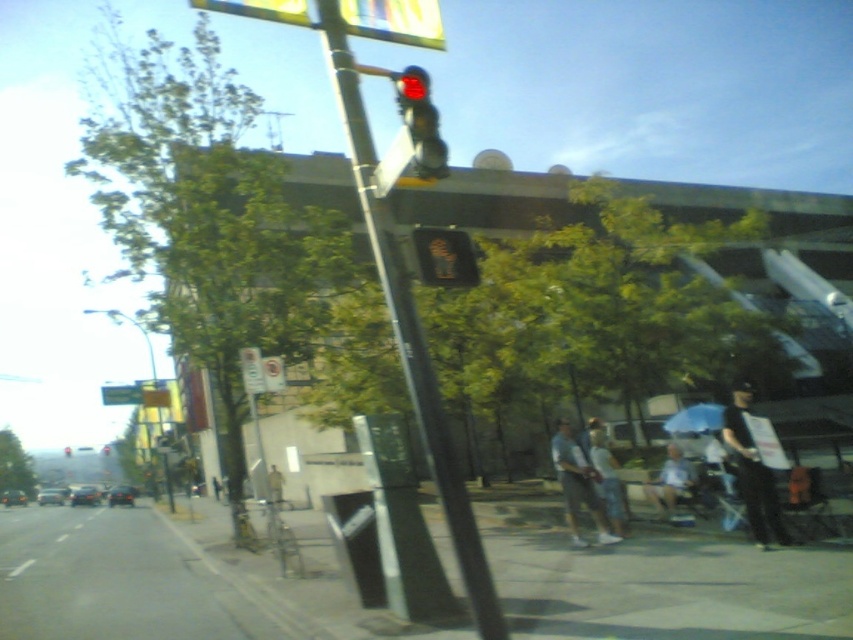
You are a pedestrian approaching the crosswalk and see the gray concrete sidewalk at lower center and the light blue shirt at lower right. Which object is closer to the left side of the crosswalk?

The gray concrete sidewalk at lower center is positioned on the left side of the light blue shirt at lower right, so the gray concrete sidewalk at lower center is closer to the left side of the crosswalk.

Based on the photo, you are a delivery person standing at the crosswalk and need to locate the light blue jeans at lower center. According to the coordinates provided, in which direction should you look relative to your position?

The light blue jeans at lower center is located at coordinates point (577, 484), so you should look towards the lower center direction relative to your position.